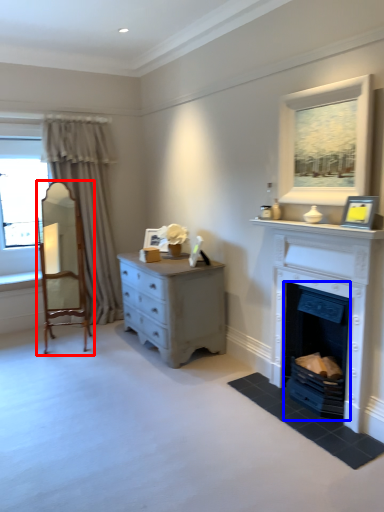
Question: Which point is further to the camera, armchair (highlighted by a red box) or fireplace (highlighted by a blue box)?

Choices:
 (A) armchair
 (B) fireplace

Answer: (A)